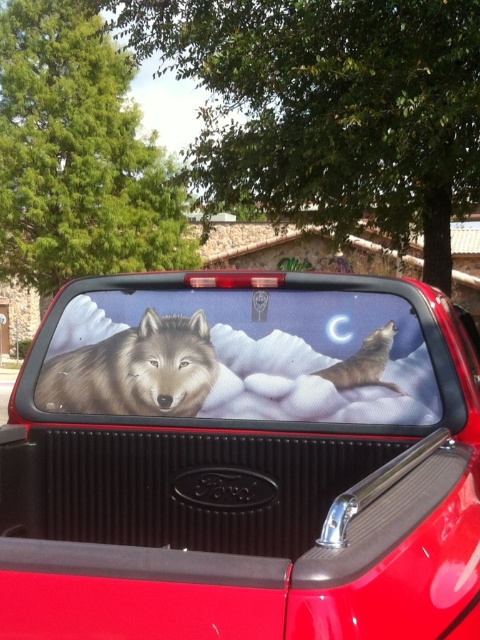
Question: Does gray matte wolf at center have a smaller size compared to gray matte wolf at upper right?

Choices:
 (A) yes
 (B) no

Answer: (B)

Question: Which of the following is the closest to the observer?

Choices:
 (A) (132, 400)
 (B) (43, 476)

Answer: (A)

Question: Which point appears farthest from the camera in this image?

Choices:
 (A) (367, 348)
 (B) (359, 400)

Answer: (A)

Question: Can you confirm if matte plastic truck bed at center is thinner than gray matte wolf at center?

Choices:
 (A) no
 (B) yes

Answer: (A)

Question: Is gray matte wolf at center thinner than gray matte wolf at upper right?

Choices:
 (A) yes
 (B) no

Answer: (B)

Question: Which object is farther from the camera taking this photo?

Choices:
 (A) gray matte wolf at center
 (B) gray matte wolf at upper right
 (C) matte plastic truck bed at center

Answer: (A)